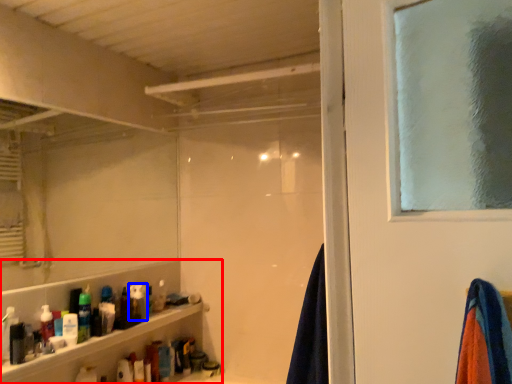
Question: Which object appears closest to the camera in this image, shelf (highlighted by a red box) or toiletry (highlighted by a blue box)?

Choices:
 (A) shelf
 (B) toiletry

Answer: (A)